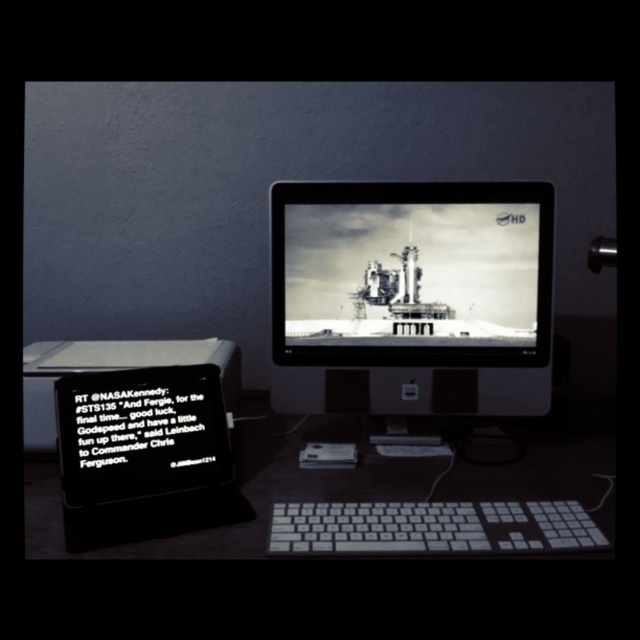
You are organizing your desk and need to place a new wireless charger between the white plastic keyboard at center and the black matte tablet at lower left. Based on their positions, where should the wireless charger be placed relative to the tablet?

The wireless charger should be placed in front of the black matte tablet at lower left, as the white plastic keyboard at center is already positioned in front of it.